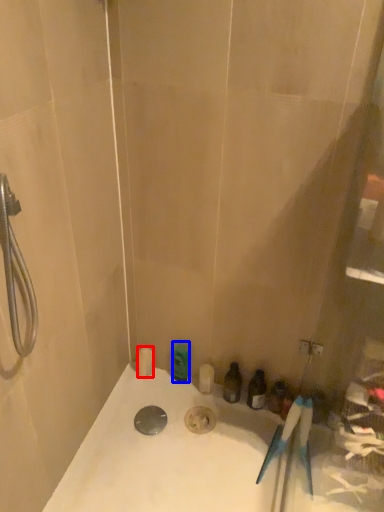
Question: Which object appears closest to the camera in this image, toiletry (highlighted by a red box) or toiletry (highlighted by a blue box)?

Choices:
 (A) toiletry
 (B) toiletry

Answer: (B)